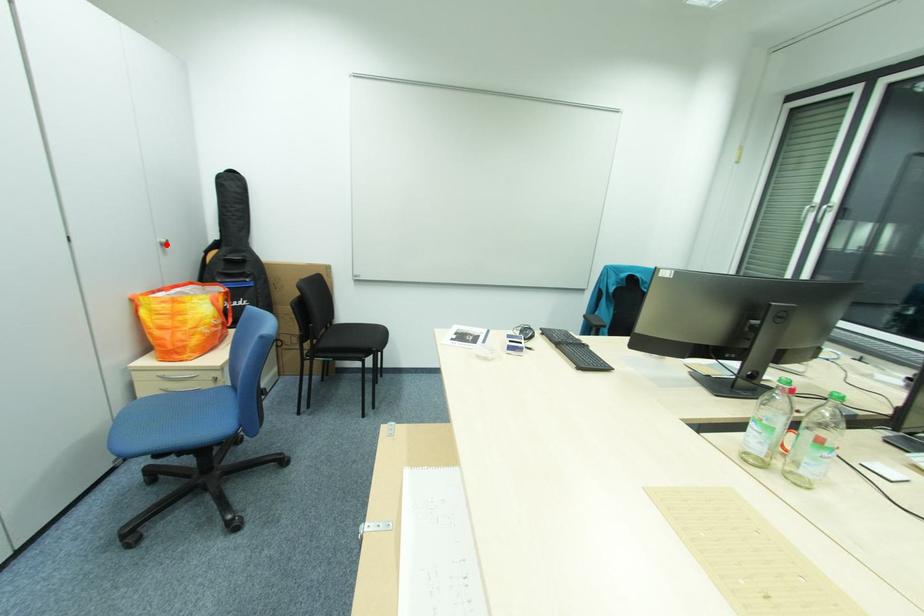
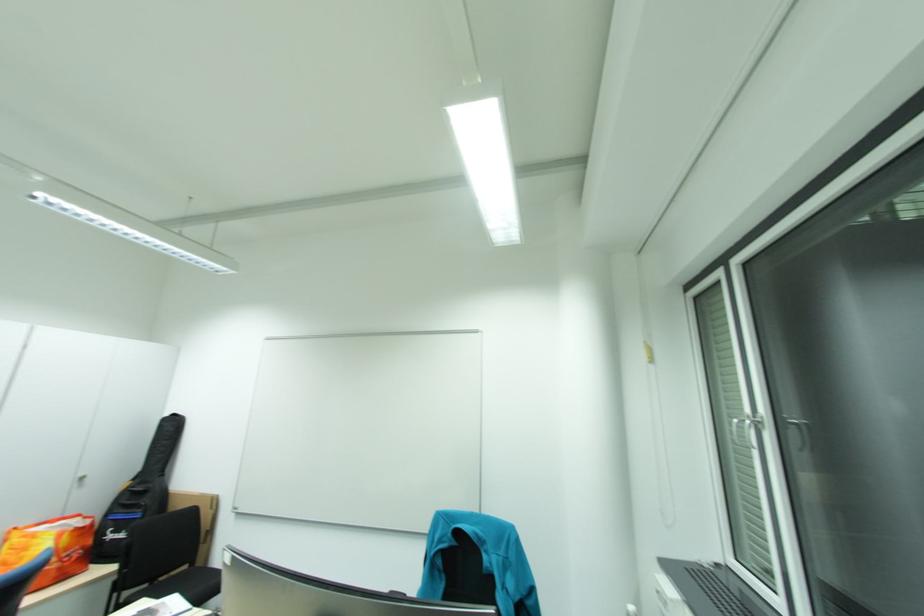
The point at the highlighted location is marked in the first image. Where is the corresponding point in the second image?

(86, 480)